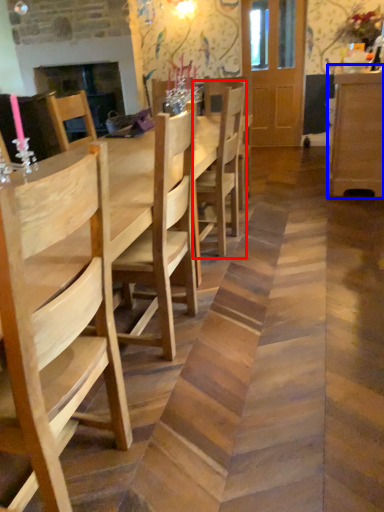
Question: Which object appears farthest to the camera in this image, chair (highlighted by a red box) or dresser (highlighted by a blue box)?

Choices:
 (A) chair
 (B) dresser

Answer: (B)